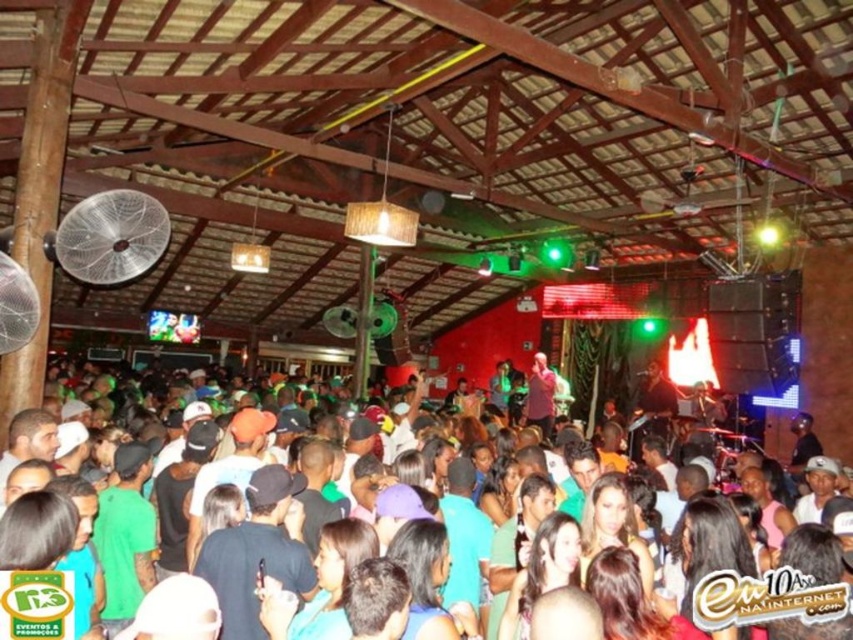
You are at a concert venue with a wooden roof and corrugated metal ceiling. You see a point marked at coordinates (171,522). What object or feature does this point correspond to?

The point at coordinates (171,522) corresponds to the matte black crowd at center.

You are at the concert and notice the white plastic fan at upper left. Where exactly is it positioned relative to the stage and the crowd?

The white plastic fan at upper left is located at point coordinates 0.370 on the x axis and 0.132 on the y axis, which places it near the upper left corner of the venue, likely above and to the side of the stage, away from the dense crowd area.